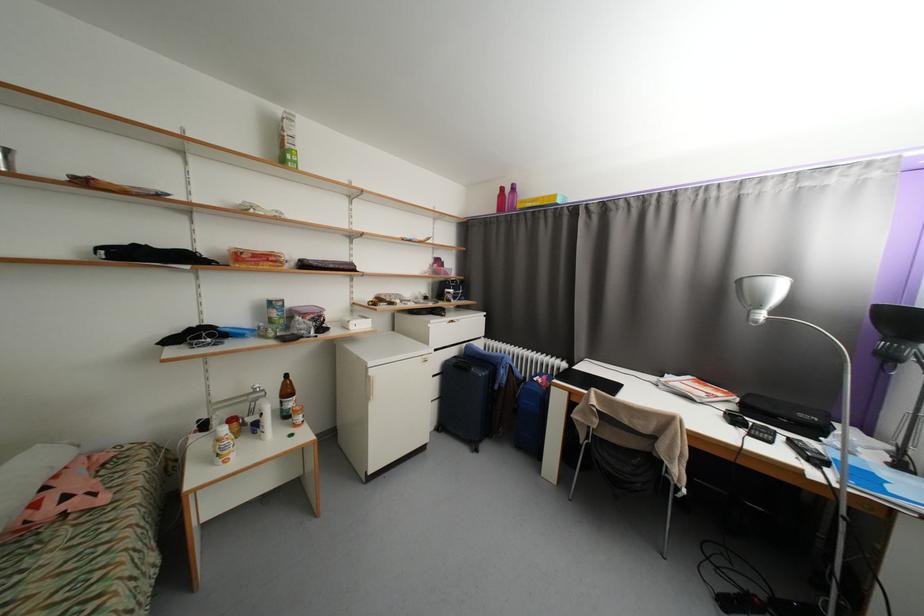
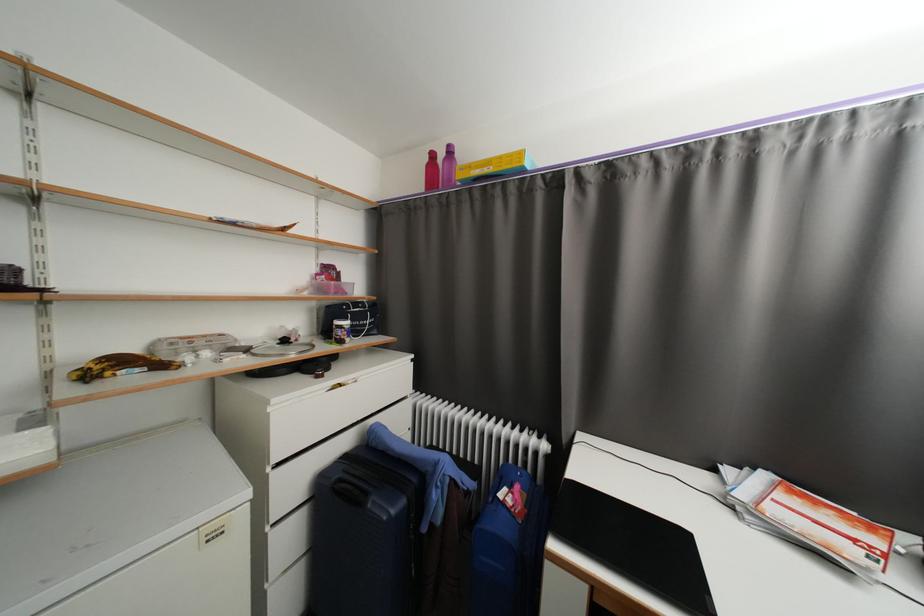
The point at (456, 297) is marked in the first image. Where is the corresponding point in the second image?

(346, 334)